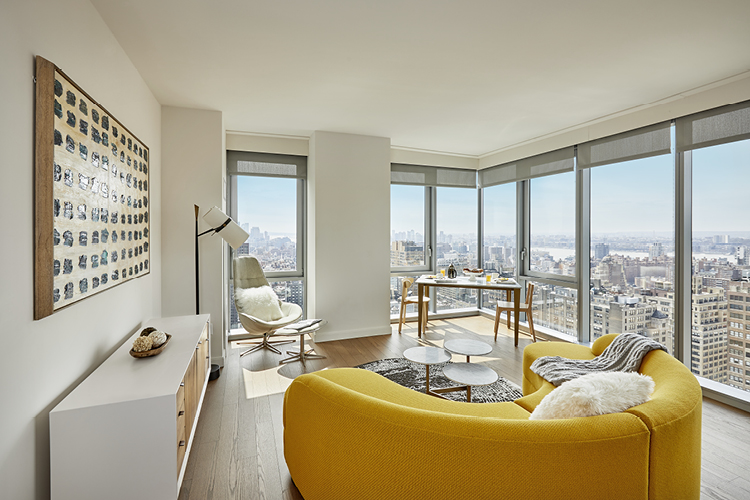
Where is `wooden chairs`? This screenshot has width=750, height=500. wooden chairs is located at coordinates (528, 300), (399, 304).